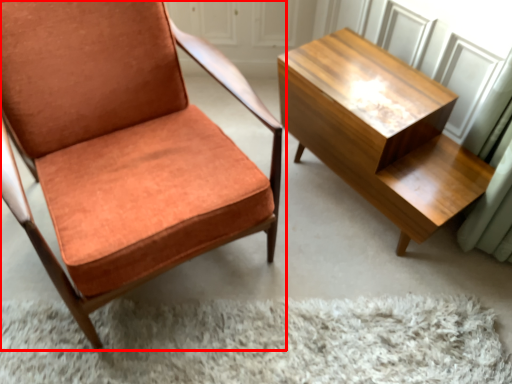
Question: In this image, where is chair (annotated by the red box) located relative to table?

Choices:
 (A) left
 (B) right

Answer: (A)